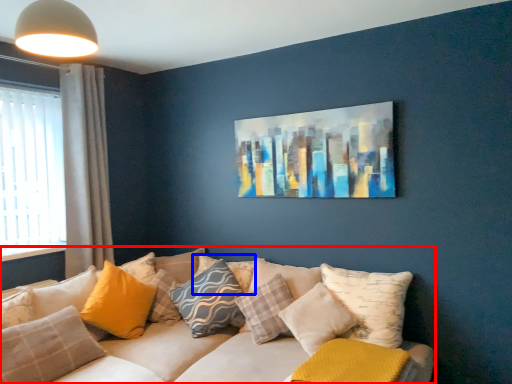
Question: Which object is further to the camera taking this photo, studio couch (highlighted by a red box) or pillow (highlighted by a blue box)?

Choices:
 (A) studio couch
 (B) pillow

Answer: (B)